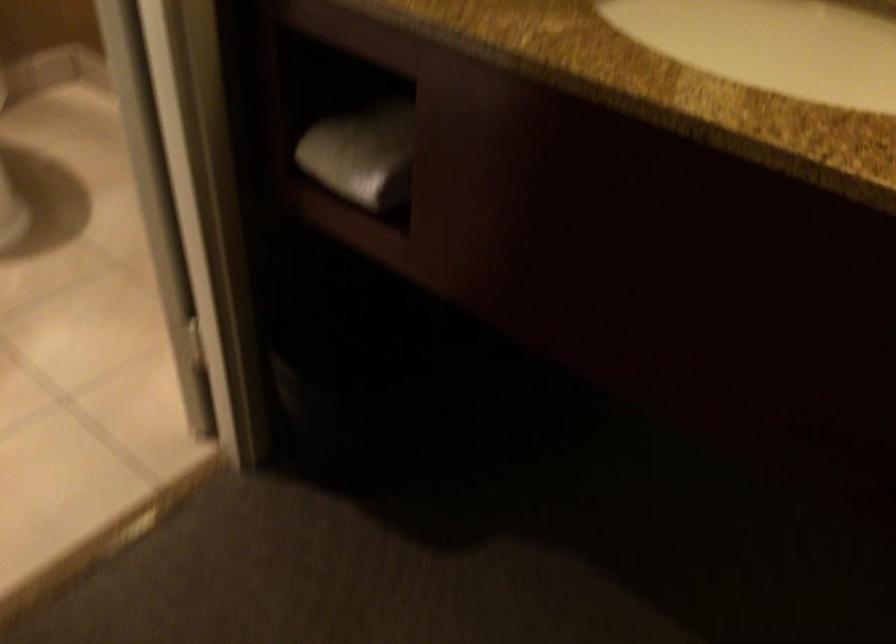
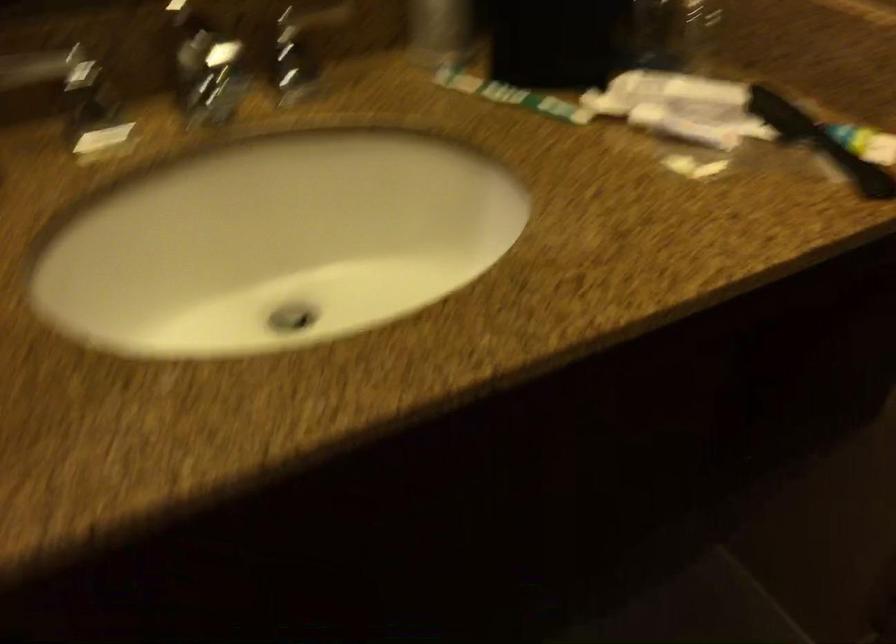
First-person continuous shooting, in which direction is the camera rotating?

The camera's rotation is toward right-down.